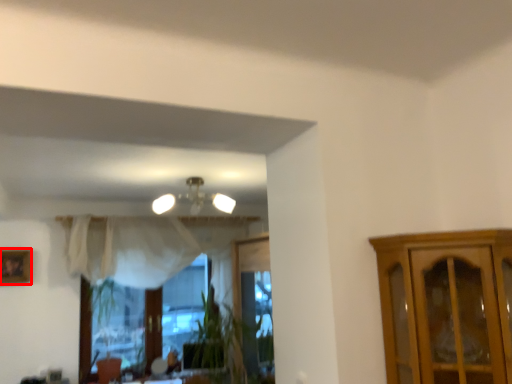
Question: Considering the relative positions of picture frame (annotated by the red box) and lamp in the image provided, where is picture frame (annotated by the red box) located with respect to the staircase?

Choices:
 (A) right
 (B) left

Answer: (B)